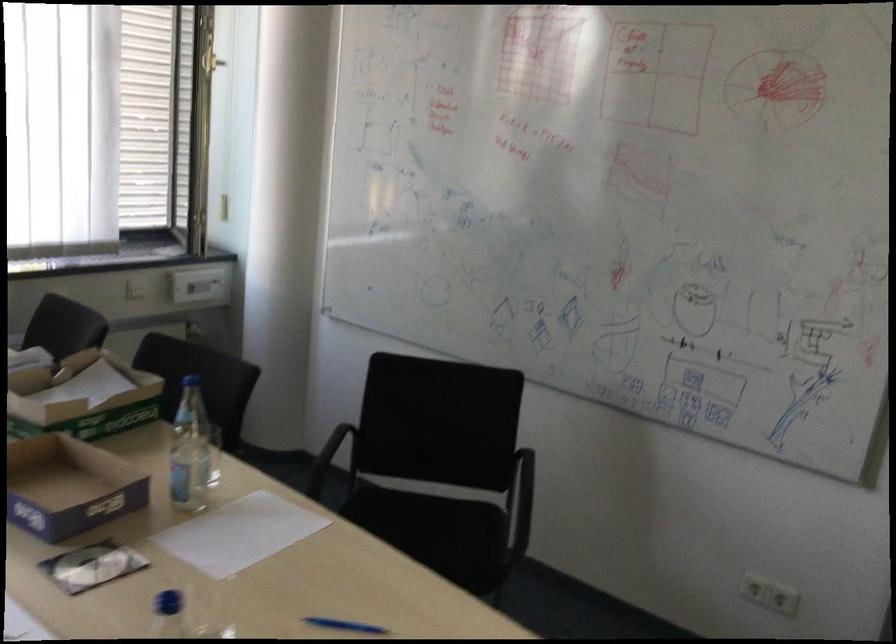
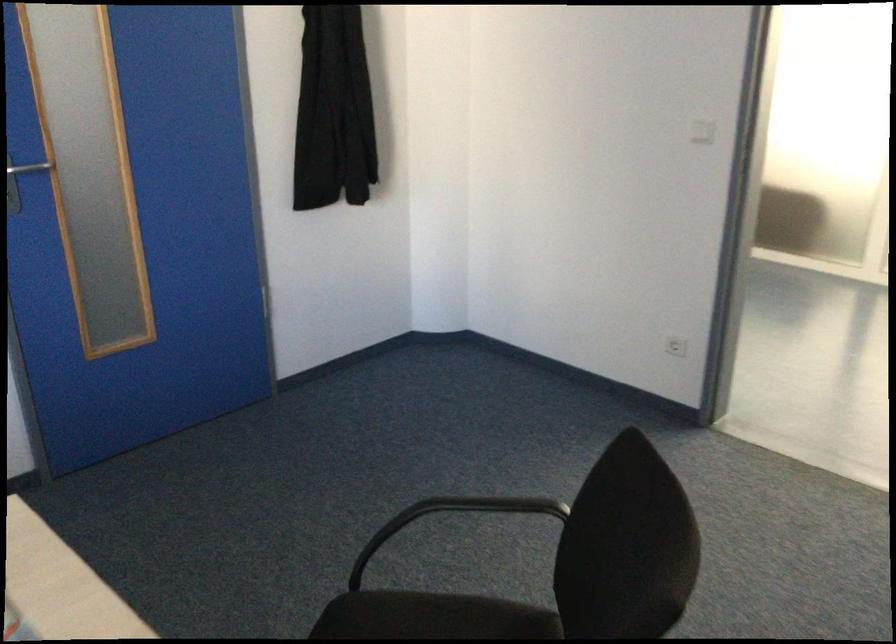
The images are taken continuously from a first-person perspective. In which direction is your viewpoint rotating?

The camera's rotation is toward right-down.